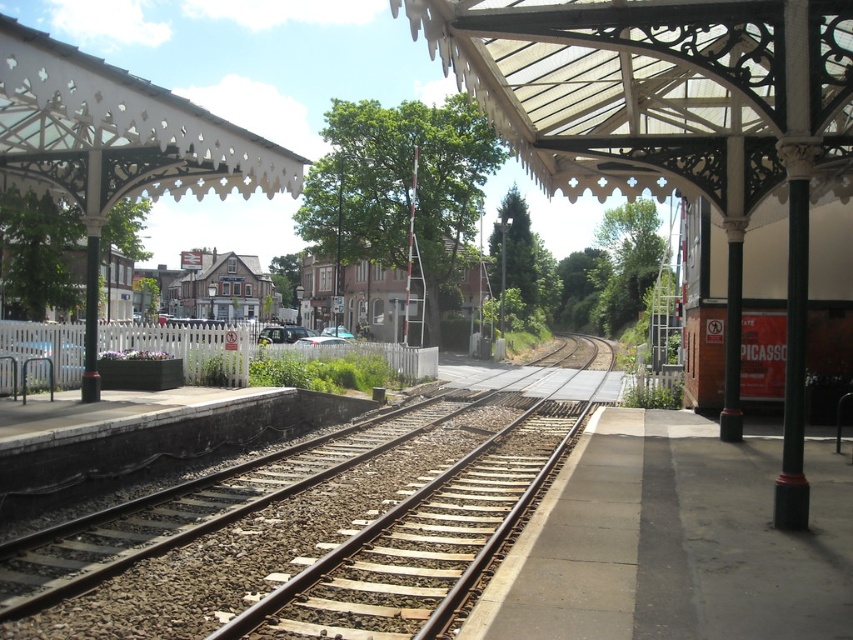
You are standing at the entrance of the station and want to walk to the brown gravel train track at center. According to the image, in which direction should you walk from your current position?

The brown gravel train track at center is located at point (318, 524), so you should walk towards the center of the image to reach it.

You are a maintenance worker checking the railway station. You need to determine which area requires more material for expansion between the brown gravel train track at center and the concrete platform at center. Based on their sizes, which one would need more material?

The brown gravel train track at center has a larger size compared to the concrete platform at center, so it would require more material for expansion.

You are a passenger waiting on the concrete platform at center. You want to board the train that is approaching along the brown gravel train track at center. Which direction should you move to in order to reach the train safely?

The concrete platform at center is behind the brown gravel train track at center, so you should move forward towards the brown gravel train track at center to reach the train safely.